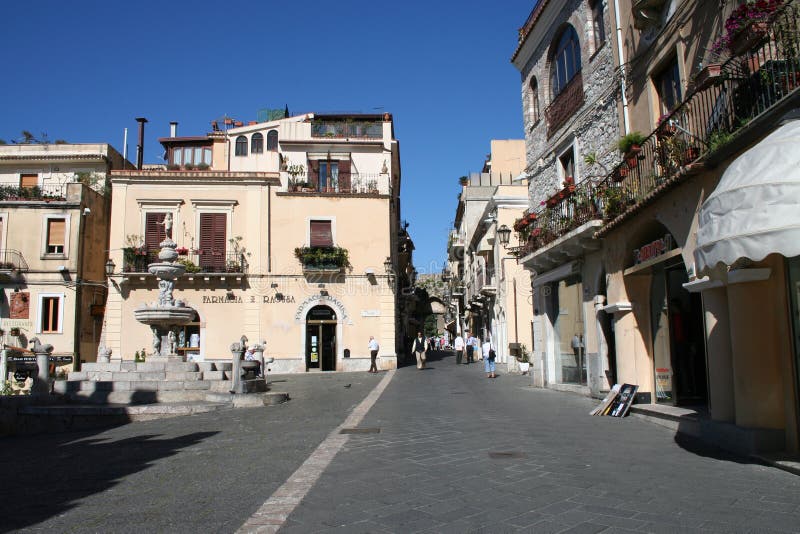
The height and width of the screenshot is (534, 800). What are the coordinates of `plant` in the screenshot? It's located at pos(632,140).